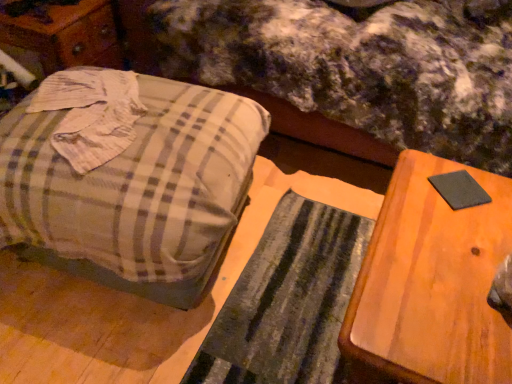
Question: Is plaid fabric mattress at center to the left of black felt pad at right from the viewer's perspective?

Choices:
 (A) no
 (B) yes

Answer: (B)

Question: From a real-world perspective, is plaid fabric mattress at center on black felt pad at right?

Choices:
 (A) yes
 (B) no

Answer: (B)

Question: Are plaid fabric mattress at center and black felt pad at right located far from each other?

Choices:
 (A) no
 (B) yes

Answer: (A)

Question: Is plaid fabric mattress at center wider than black felt pad at right?

Choices:
 (A) yes
 (B) no

Answer: (A)

Question: Is plaid fabric mattress at center positioned in front of black felt pad at right?

Choices:
 (A) no
 (B) yes

Answer: (A)

Question: Looking at the image, does wooden table at right seem bigger or smaller compared to plaid fabric suitcase at left?

Choices:
 (A) small
 (B) big

Answer: (A)

Question: Is wooden table at right spatially inside plaid fabric suitcase at left, or outside of it?

Choices:
 (A) inside
 (B) outside

Answer: (B)

Question: In terms of width, does wooden table at right look wider or thinner when compared to plaid fabric suitcase at left?

Choices:
 (A) thin
 (B) wide

Answer: (A)

Question: From their relative heights in the image, would you say wooden table at right is taller or shorter than plaid fabric suitcase at left?

Choices:
 (A) short
 (B) tall

Answer: (A)

Question: Looking at their shapes, would you say black felt pad at right is wider or thinner than wooden table at right?

Choices:
 (A) wide
 (B) thin

Answer: (B)

Question: Is black felt pad at right in front of or behind wooden table at right in the image?

Choices:
 (A) front
 (B) behind

Answer: (B)

Question: From their relative heights in the image, would you say black felt pad at right is taller or shorter than wooden table at right?

Choices:
 (A) short
 (B) tall

Answer: (A)

Question: In the image, is black felt pad at right on the left side or the right side of wooden table at right?

Choices:
 (A) left
 (B) right

Answer: (B)

Question: From the image's perspective, is black felt pad at right located above or below plaid fabric mattress at center?

Choices:
 (A) above
 (B) below

Answer: (B)

Question: Visually, is black felt pad at right positioned to the left or to the right of plaid fabric mattress at center?

Choices:
 (A) left
 (B) right

Answer: (B)